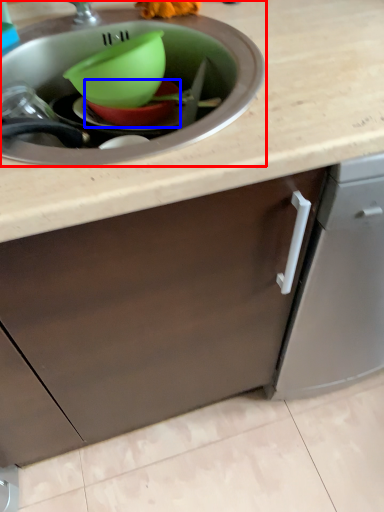
Question: Which object appears farthest to the camera in this image, sink (highlighted by a red box) or basin (highlighted by a blue box)?

Choices:
 (A) sink
 (B) basin

Answer: (B)